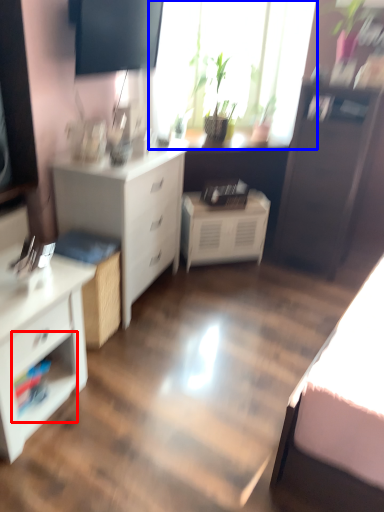
Question: Which object appears farthest to the camera in this image, shelf (highlighted by a red box) or window (highlighted by a blue box)?

Choices:
 (A) shelf
 (B) window

Answer: (B)